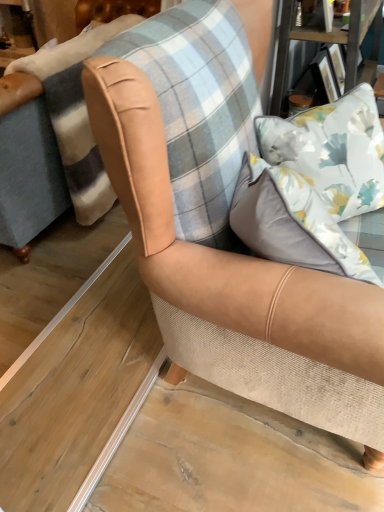
Question: Would you say tan leather armchair at center is inside or outside floral fabric pillow at upper right, marked as the first pillow in a back-to-front arrangement?

Choices:
 (A) inside
 (B) outside

Answer: (B)

Question: Is tan leather armchair at center wider or thinner than floral fabric pillow at upper right, marked as the first pillow in a back-to-front arrangement?

Choices:
 (A) wide
 (B) thin

Answer: (A)

Question: Considering the real-world distances, which object is closest to the floral fabric pillow at upper right, marked as the first pillow in a back-to-front arrangement?

Choices:
 (A) tan leather armchair at center
 (B) white satin pillow at upper right, positioned as the first pillow in front-to-back order

Answer: (B)

Question: Which object is positioned closest to the floral fabric pillow at upper right, marked as the first pillow in a back-to-front arrangement?

Choices:
 (A) white satin pillow at upper right, positioned as the second pillow in back-to-front order
 (B) tan leather armchair at center

Answer: (A)